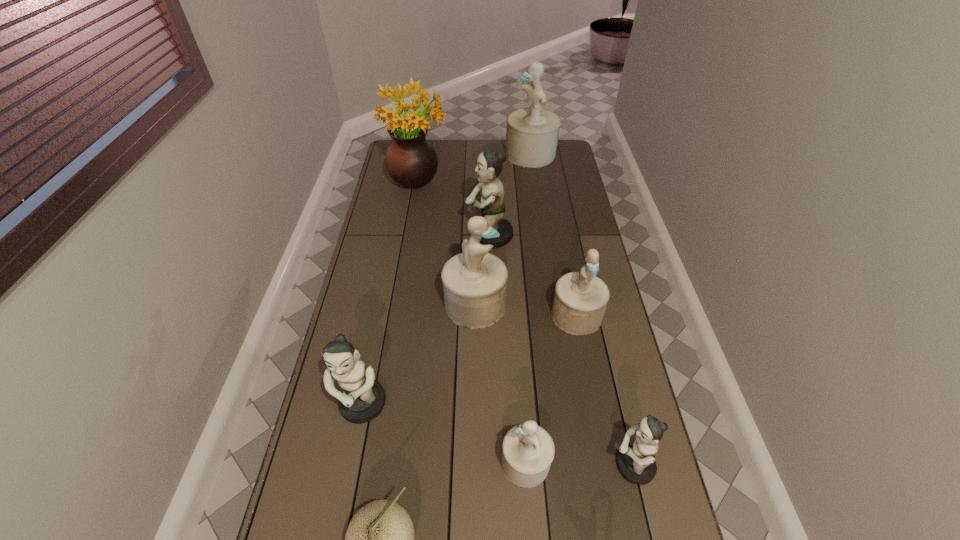
The height and width of the screenshot is (540, 960). Identify the location of the farthest figurine. (532, 133).

Where is `the farthest white figurine`? the farthest white figurine is located at coordinates (532, 133).

Identify the location of flower arrangement. (411, 161).

Where is `the biggest green figurine`? This screenshot has width=960, height=540. the biggest green figurine is located at coordinates (489, 163).

Identify the location of the seventh nearest object. (489, 163).

At what (x,y) coordinates should I click in order to perform the action: click on the third smallest white figurine. Please return your answer as a coordinate pair (x, y). Image resolution: width=960 pixels, height=540 pixels. Looking at the image, I should click on (474, 282).

Locate an element on the screen. The height and width of the screenshot is (540, 960). the second nearest green figurine is located at coordinates (362, 399).

Locate an element on the screen. the fifth farthest figurine is located at coordinates (362, 399).

The width and height of the screenshot is (960, 540). Identify the location of the second smallest white figurine. (580, 299).

Find the location of a particular element. The width and height of the screenshot is (960, 540). the smallest white figurine is located at coordinates (527, 451).